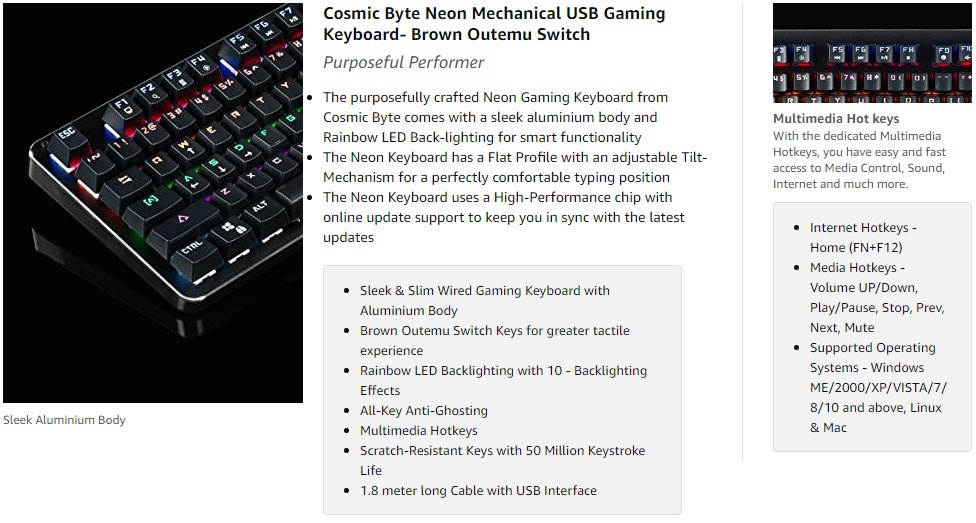
Find the location of a particular element. keyboard is located at coordinates (179, 210), (870, 73).